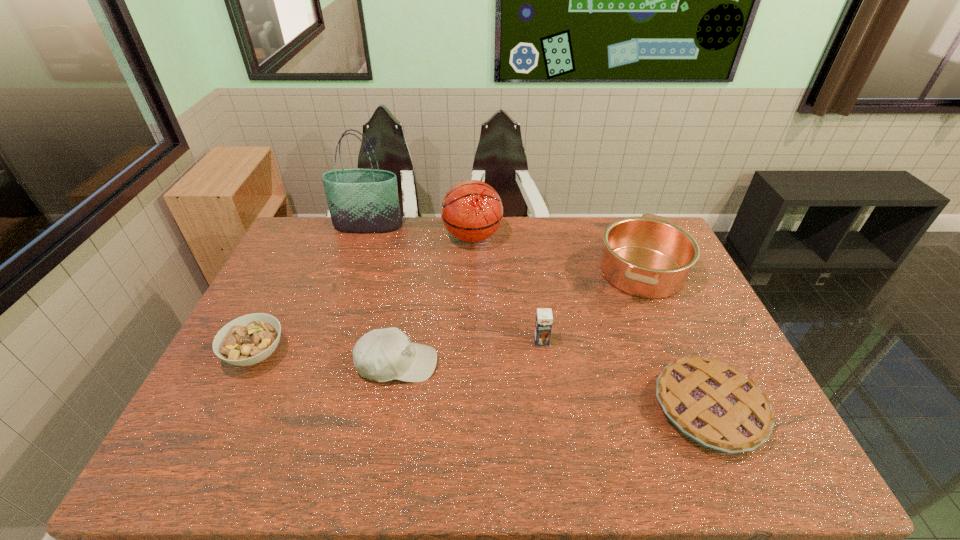
Where is `vacant space that is in between the shortest object and the baseball cap`? This screenshot has width=960, height=540. vacant space that is in between the shortest object and the baseball cap is located at coordinates (553, 386).

The width and height of the screenshot is (960, 540). Find the location of `vacant space that's between the shortest object and the stew`. vacant space that's between the shortest object and the stew is located at coordinates pos(482,381).

Where is `empty space that is in between the baseball cap and the tote bag`? This screenshot has height=540, width=960. empty space that is in between the baseball cap and the tote bag is located at coordinates 383,295.

Locate an element on the screen. The height and width of the screenshot is (540, 960). vacant point located between the chocolate milk and the baseball cap is located at coordinates (469, 352).

I want to click on vacant space that's between the stew and the saucepan, so click(449, 313).

The height and width of the screenshot is (540, 960). I want to click on free point between the stew and the basketball, so click(x=365, y=295).

Where is `vacant space that's between the chocolate milk and the basketball`? vacant space that's between the chocolate milk and the basketball is located at coordinates (507, 289).

Find the location of a particular element. The width and height of the screenshot is (960, 540). free area in between the saucepan and the stew is located at coordinates (449, 313).

At what (x,y) coordinates should I click in order to perform the action: click on object that is the fourth closest to the baseball cap. Please return your answer as a coordinate pair (x, y). Looking at the image, I should click on (649, 257).

This screenshot has height=540, width=960. I want to click on object identified as the third closest to the stew, so click(x=472, y=211).